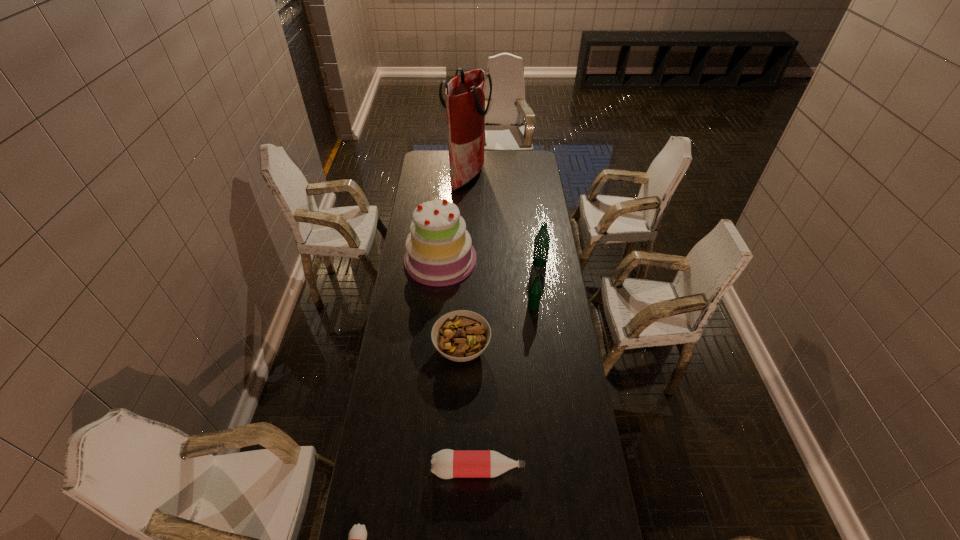
Choose which pink bottle is the nearest neighbor to the farther green bottle. Please provide its 2D coordinates. Your answer should be formatted as a tuple, i.e. [(x, y)], where the tuple contains the x and y coordinates of a point satisfying the conditions above.

[(446, 464)]

Identify which pink bottle is the second nearest to the fourth nearest object. Please provide its 2D coordinates. Your answer should be formatted as a tuple, i.e. [(x, y)], where the tuple contains the x and y coordinates of a point satisfying the conditions above.

[(357, 536)]